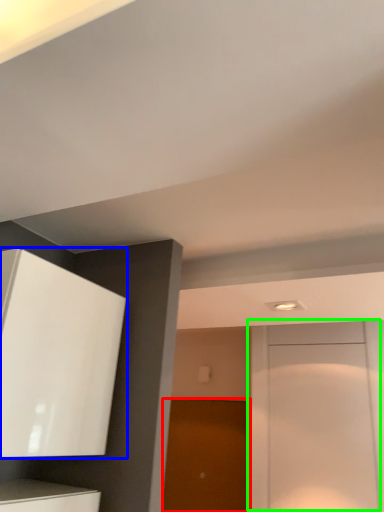
Question: Based on their relative distances, which object is farther from door (highlighted by a red box)? Choose from cabinetry (highlighted by a blue box) and door (highlighted by a green box).

Choices:
 (A) cabinetry
 (B) door

Answer: (A)